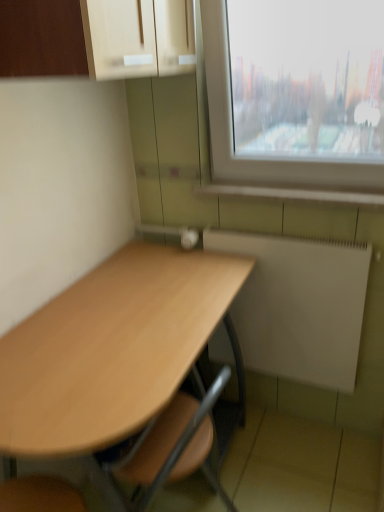
Identify the location of vacant space underneath matte wood cabinet at upper left (from a real-world perspective). (145, 272).